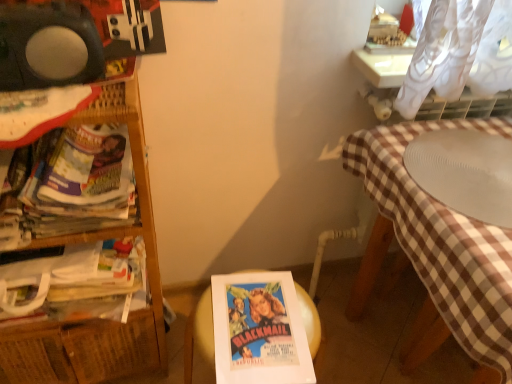
Locate an element on the screen. The height and width of the screenshot is (384, 512). free spot above white paper at center (from a real-world perspective) is located at coordinates (255, 317).